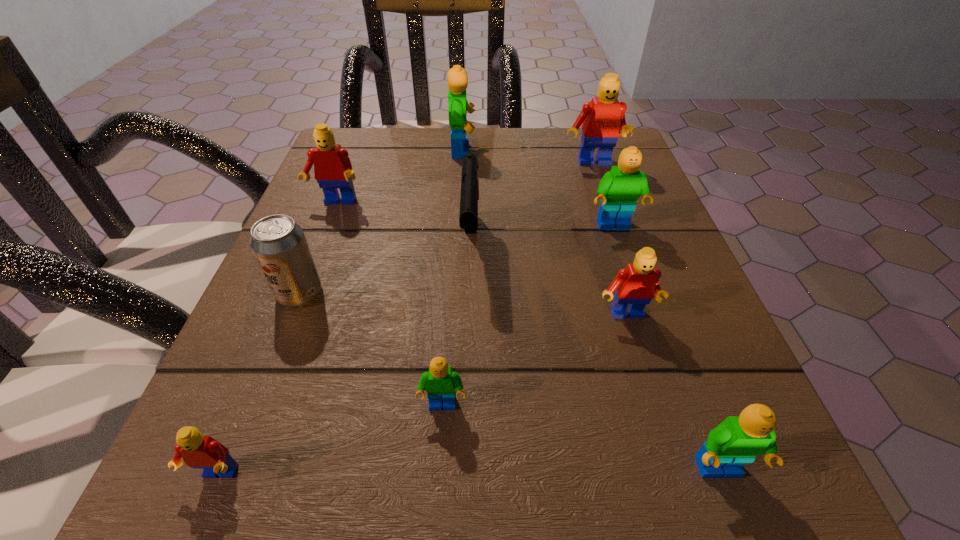
The width and height of the screenshot is (960, 540). In the image, there is a desktop. What are the coordinates of `vacant space at the far left corner` in the screenshot? It's located at (374, 145).

Locate an element on the screen. The image size is (960, 540). vacant space at the near left corner of the desktop is located at coordinates (277, 530).

This screenshot has width=960, height=540. Identify the location of blank space at the far right corner of the desktop. pyautogui.click(x=579, y=179).

Where is `free space at the near right corner`? free space at the near right corner is located at coordinates (801, 503).

Where is `free space between the pistol and the third biggest green Lego`? free space between the pistol and the third biggest green Lego is located at coordinates (595, 358).

Where is `vacant region between the second smallest green Lego and the black pistol`? vacant region between the second smallest green Lego and the black pistol is located at coordinates (595, 358).

Locate an element on the screen. free space between the biggest red Lego and the biggest green Lego is located at coordinates (527, 158).

You are a GUI agent. You are given a task and a screenshot of the screen. Output one action in this format:
    pyautogui.click(x=<x>, y=<y>)
    Task: Click on the free space between the nearest red Lego and the second biggest green Lego
    
    Given the screenshot: What is the action you would take?
    pyautogui.click(x=415, y=351)

Identify the location of free space between the black pistol and the third nearest green Lego. (542, 236).

Where is `vacant space that is in between the nearest green Lego and the second farthest green Lego`? vacant space that is in between the nearest green Lego and the second farthest green Lego is located at coordinates (666, 349).